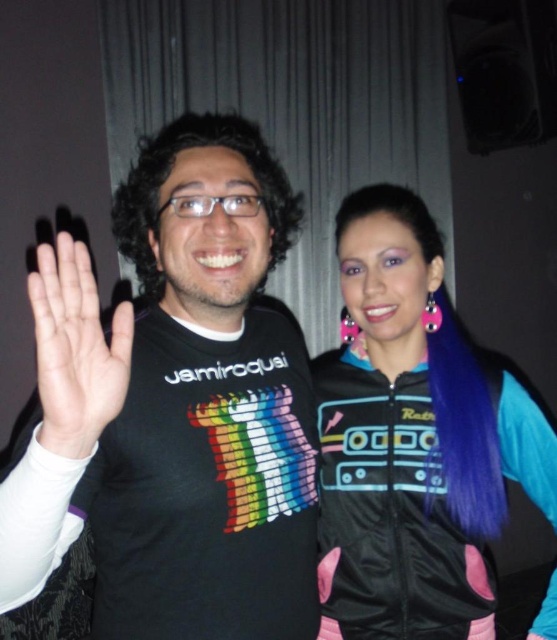
Describe the element at coordinates (413, 442) in the screenshot. The image size is (557, 640). I see `blue synthetic wig at upper right` at that location.

Based on the photo, can you confirm if blue synthetic wig at upper right is positioned below dark curly hair at center?

Indeed, blue synthetic wig at upper right is positioned under dark curly hair at center.

Which is in front, point (384, 538) or point (134, 264)?

Point (384, 538) is more forward.

Identify the location of blue synthetic wig at upper right. The height and width of the screenshot is (640, 557). (413, 442).

Is blue synthetic wig at upper right to the left of white matte hand at center from the viewer's perspective?

→ In fact, blue synthetic wig at upper right is to the right of white matte hand at center.

Is point (460, 400) closer to viewer compared to point (69, 276)?

No, (460, 400) is behind (69, 276).

I want to click on blue synthetic wig at upper right, so click(413, 442).

From the picture: Which is below, white matte hand at center or dark curly hair at center?

white matte hand at center

Can you confirm if white matte hand at center is positioned below dark curly hair at center?

Correct, white matte hand at center is located below dark curly hair at center.

Is point (37, 388) positioned after point (120, 186)?

That is False.

I want to click on white matte hand at center, so click(75, 349).